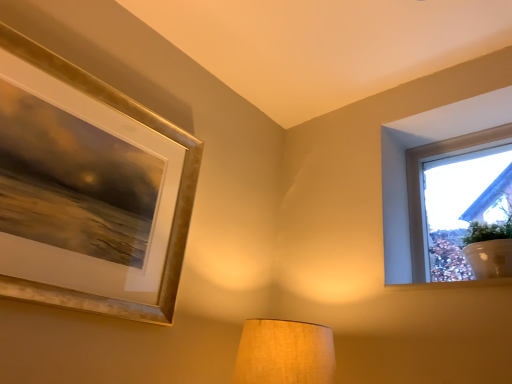
Question: Is transparent glass window at upper right bigger or smaller than matte beige lampshade at center?

Choices:
 (A) big
 (B) small

Answer: (A)

Question: From the image's perspective, is transparent glass window at upper right above or below matte beige lampshade at center?

Choices:
 (A) above
 (B) below

Answer: (A)

Question: Which is farther from the white painted wood at upper right?

Choices:
 (A) transparent glass window at upper right
 (B) matte beige lampshade at center
 (C) gold metallic picture frame at upper left

Answer: (C)

Question: Based on their relative distances, which object is farther from the matte beige lampshade at center?

Choices:
 (A) white painted wood at upper right
 (B) transparent glass window at upper right
 (C) gold metallic picture frame at upper left

Answer: (B)